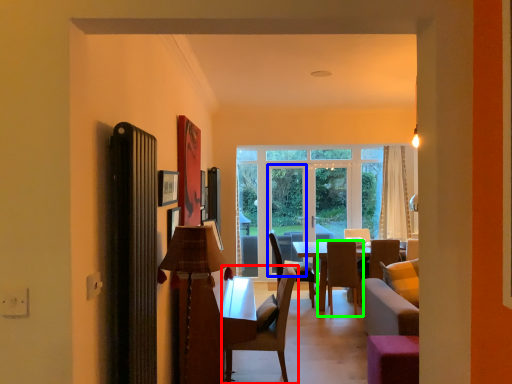
Question: Estimate the real-world distances between objects in this image. Which object is farther from chair (highlighted by a red box), screen door (highlighted by a blue box) or chair (highlighted by a green box)?

Choices:
 (A) screen door
 (B) chair

Answer: (A)